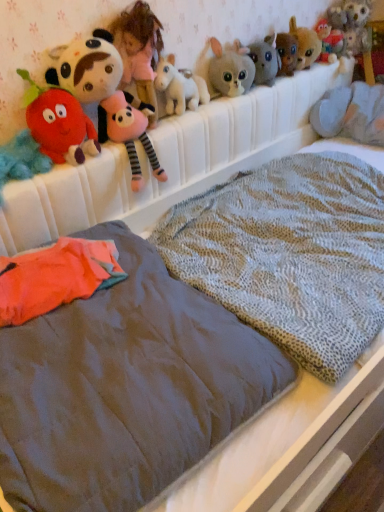
Describe the element at coordinates (139, 51) in the screenshot. I see `soft pink plush doll at upper center` at that location.

From the picture: Measure the distance between fluffy red plush toy at left, positioned as the 1th toy in left-to-right order, and camera.

fluffy red plush toy at left, positioned as the 1th toy in left-to-right order, is 1.10 meters from camera.

What do you see at coordinates (305, 44) in the screenshot? This screenshot has width=384, height=512. I see `fuzzy brown plush at upper center, acting as the second toy starting from the right` at bounding box center [305, 44].

This screenshot has height=512, width=384. Find the location of `gray plush toy at upper right`. gray plush toy at upper right is located at coordinates (351, 113).

What's the angular difference between soft pink plush doll at upper center and smooth gray mattress at center's facing directions?

The angle between the facing direction of soft pink plush doll at upper center and the facing direction of smooth gray mattress at center is 0.00103 degrees.

Considering the positions of point (149, 60) and point (58, 458), is point (149, 60) closer or farther from the camera than point (58, 458)?

Point (149, 60) is farther from the camera than point (58, 458).

From a real-world perspective, is soft pink plush doll at upper center positioned above or below smooth gray mattress at center?

soft pink plush doll at upper center is situated higher than smooth gray mattress at center in the real world.

Between soft pink plush doll at upper center and smooth gray mattress at center, which one has larger width?

Wider between the two is smooth gray mattress at center.

Between point (303, 36) and point (53, 145), which one is positioned in front?

The point (53, 145) is closer.

Considering the sizes of objects fuzzy brown plush at upper center, acting as the second toy starting from the right, and fluffy plush strawberry at left, acting as the 2th toy starting from the left, in the image provided, who is thinner, fuzzy brown plush at upper center, acting as the second toy starting from the right, or fluffy plush strawberry at left, acting as the 2th toy starting from the left,?

Thinner between the two is fluffy plush strawberry at left, acting as the 2th toy starting from the left.

Is fuzzy brown plush at upper center, acting as the second toy starting from the right, with fluffy plush strawberry at left, the sixth toy when ordered from right to left?

They are not placed beside each other.

Is fuzzy brown plush at upper center, acting as the second toy starting from the right, outside of fluffy plush strawberry at left, the sixth toy when ordered from right to left?

Yes, fuzzy brown plush at upper center, acting as the second toy starting from the right, is located beyond the bounds of fluffy plush strawberry at left, the sixth toy when ordered from right to left.

Are fluffy plush strawberry at left, acting as the 2th toy starting from the left, and fluffy red plush toy at left, the seventh toy positioned from the right, making contact?

Yes, the surface of fluffy plush strawberry at left, acting as the 2th toy starting from the left, is in contact with fluffy red plush toy at left, the seventh toy positioned from the right.

Is fluffy plush strawberry at left, acting as the 2th toy starting from the left, wider or thinner than fluffy red plush toy at left, the seventh toy positioned from the right?

Clearly, fluffy plush strawberry at left, acting as the 2th toy starting from the left, has less width compared to fluffy red plush toy at left, the seventh toy positioned from the right.

Consider the image. Is fluffy plush strawberry at left, the sixth toy when ordered from right to left, at the left side of fluffy red plush toy at left, positioned as the 1th toy in left-to-right order?

No.

From a real-world perspective, is textured gray blanket at center physically below fluffy beige plush at upper center, which is the fourth toy in right-to-left order?

Indeed, from a real-world perspective, textured gray blanket at center is positioned beneath fluffy beige plush at upper center, which is the fourth toy in right-to-left order.

Is textured gray blanket at center further to camera compared to fluffy beige plush at upper center, which is the fourth toy in right-to-left order?

That is False.

Is fluffy beige plush at upper center, marked as the 4th toy in a left-to-right arrangement, looking in the opposite direction of soft pink plush doll at upper center?

fluffy beige plush at upper center, marked as the 4th toy in a left-to-right arrangement, does not have its back to soft pink plush doll at upper center.

Is fluffy beige plush at upper center, which is the fourth toy in right-to-left order, smaller than soft pink plush doll at upper center?

Yes, fluffy beige plush at upper center, which is the fourth toy in right-to-left order, is smaller than soft pink plush doll at upper center.

Between fluffy beige plush at upper center, which is the fourth toy in right-to-left order, and soft pink plush doll at upper center, which one has less height?

Standing shorter between the two is fluffy beige plush at upper center, which is the fourth toy in right-to-left order.

From the image's perspective, which object appears higher, fluffy beige plush at upper center, marked as the 4th toy in a left-to-right arrangement, or soft pink plush doll at upper center?

fluffy beige plush at upper center, marked as the 4th toy in a left-to-right arrangement.

Are fluffy gray rabbit at upper center, acting as the fifth toy starting from the left, and smooth gray mattress at center beside each other?

No, fluffy gray rabbit at upper center, acting as the fifth toy starting from the left, is not with smooth gray mattress at center.

In the scene shown: Is fluffy gray rabbit at upper center, positioned as the third toy in right-to-left order, taller than smooth gray mattress at center?

Correct, fluffy gray rabbit at upper center, positioned as the third toy in right-to-left order, is much taller as smooth gray mattress at center.

Which of these two, fluffy gray rabbit at upper center, acting as the fifth toy starting from the left, or smooth gray mattress at center, is wider?

smooth gray mattress at center.

Which is correct: fluffy gray rabbit at upper center, positioned as the third toy in right-to-left order, is inside smooth gray mattress at center, or outside of it?

fluffy gray rabbit at upper center, positioned as the third toy in right-to-left order, is located beyond the bounds of smooth gray mattress at center.

Does fluffy plush strawberry at left, acting as the 2th toy starting from the left, contain textured gray blanket at center?

No.

From a real-world perspective, is fluffy plush strawberry at left, the sixth toy when ordered from right to left, over textured gray blanket at center?

Yes, from a real-world perspective, fluffy plush strawberry at left, the sixth toy when ordered from right to left, is over textured gray blanket at center

How many degrees apart are the facing directions of fluffy plush strawberry at left, the sixth toy when ordered from right to left, and textured gray blanket at center?

The facing directions of fluffy plush strawberry at left, the sixth toy when ordered from right to left, and textured gray blanket at center are 5.29 degrees apart.

Could you tell me if fluffy plush strawberry at left, the sixth toy when ordered from right to left, is turned towards textured gray blanket at center?

No.

Where is `mattress that is under the soft pink plush doll at upper center (from a real-world perspective)`? This screenshot has width=384, height=512. mattress that is under the soft pink plush doll at upper center (from a real-world perspective) is located at coordinates (125, 388).

Locate an element on the screen. This screenshot has height=512, width=384. toy that is the 4th object located below the fuzzy brown plush at upper center, which appears as the sixth toy when viewed from the left (from the image's perspective) is located at coordinates (59, 123).

Estimate the real-world distances between objects in this image. Which object is further from fluffy plush strawberry at left, acting as the 2th toy starting from the left, soft pink plush doll at upper center or white plush unicorn at upper center, which is counted as the 3th toy, starting from the left?

white plush unicorn at upper center, which is counted as the 3th toy, starting from the left.

Considering their positions, is fluffy beige plush at upper center, marked as the 4th toy in a left-to-right arrangement, positioned further to fuzzy brown plush at upper center, acting as the second toy starting from the right, than smooth gray mattress at center?

Among the two, smooth gray mattress at center is located further to fuzzy brown plush at upper center, acting as the second toy starting from the right.

From the image, which object appears to be nearer to white plush unicorn at upper center, which is counted as the 3th toy, starting from the left, fluffy red plush toy at left, the seventh toy positioned from the right, or soft pink plush doll at upper center?

soft pink plush doll at upper center is closer to white plush unicorn at upper center, which is counted as the 3th toy, starting from the left.

Considering their positions, is fluffy gray rabbit at upper center, acting as the fifth toy starting from the left, positioned further to fluffy beige plush at upper center, marked as the 4th toy in a left-to-right arrangement, than gray plush toy at upper right?

Among the two, gray plush toy at upper right is located further to fluffy beige plush at upper center, marked as the 4th toy in a left-to-right arrangement.

Based on the photo, looking at the image, which one is located closer to fluffy plush strawberry at left, the sixth toy when ordered from right to left, fluffy beige plush at upper center, marked as the 4th toy in a left-to-right arrangement, or gray plush toy at upper right?

fluffy beige plush at upper center, marked as the 4th toy in a left-to-right arrangement, lies closer to fluffy plush strawberry at left, the sixth toy when ordered from right to left, than the other object.

Considering their positions, is fuzzy brown plush at upper center, the 1th toy in the right-to-left sequence, positioned closer to fluffy red plush toy at left, the seventh toy positioned from the right, than fluffy gray rabbit at upper center, positioned as the third toy in right-to-left order?

fluffy gray rabbit at upper center, positioned as the third toy in right-to-left order, lies closer to fluffy red plush toy at left, the seventh toy positioned from the right, than the other object.

Considering their positions, is fuzzy brown plush at upper center, the seventh toy when ordered from left to right, positioned closer to textured gray blanket at center than gray plush toy at upper right?

Based on the image, gray plush toy at upper right appears to be nearer to textured gray blanket at center.

Looking at the image, which one is located closer to fluffy beige plush at upper center, which is the fourth toy in right-to-left order, white plush unicorn at upper center, which is counted as the 3th toy, starting from the left, or soft pink plush doll at upper center?

white plush unicorn at upper center, which is counted as the 3th toy, starting from the left.

In order to click on toy between fluffy gray rabbit at upper center, acting as the fifth toy starting from the left, and fuzzy brown plush at upper center, the seventh toy when ordered from left to right in this screenshot , I will do `click(305, 44)`.

You are a GUI agent. You are given a task and a screenshot of the screen. Output one action in this format:
    pyautogui.click(x=<x>, y=<y>)
    Task: Click on the doll between fluffy red plush toy at left, the seventh toy positioned from the right, and textured gray blanket at center
    The width and height of the screenshot is (384, 512).
    Given the screenshot: What is the action you would take?
    pyautogui.click(x=139, y=51)

At what (x,y) coordinates should I click in order to perform the action: click on toy between fluffy plush strawberry at left, acting as the 2th toy starting from the left, and smooth gray mattress at center from top to bottom. Please return your answer as a coordinate pair (x, y). This screenshot has width=384, height=512. Looking at the image, I should click on (21, 159).

In order to click on toy between fluffy red plush toy at left, the seventh toy positioned from the right, and white plush unicorn at upper center, which is counted as the 3th toy, starting from the left, in the horizontal direction in this screenshot , I will do `click(59, 123)`.